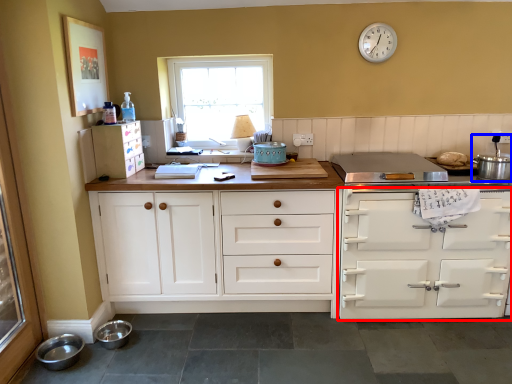
Question: Which object appears farthest to the camera in this image, cabinetry (highlighted by a red box) or appliance (highlighted by a blue box)?

Choices:
 (A) cabinetry
 (B) appliance

Answer: (A)